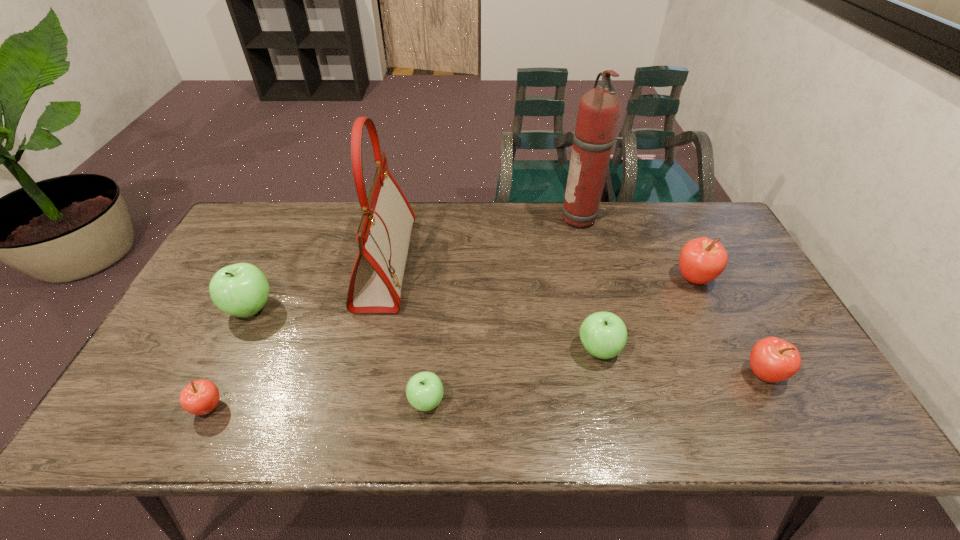
Where is `free space between the second farthest pink apple and the sixth object from right to left`? The height and width of the screenshot is (540, 960). free space between the second farthest pink apple and the sixth object from right to left is located at coordinates (575, 319).

At what (x,y) coordinates should I click in order to perform the action: click on free space between the fire extinguisher and the biggest pink apple. Please return your answer as a coordinate pair (x, y). Looking at the image, I should click on (638, 248).

This screenshot has height=540, width=960. Identify the location of vacant area that lies between the second green apple from left to right and the handbag. (406, 333).

Where is `unoccupied area between the handbag and the leftmost pink apple`? This screenshot has height=540, width=960. unoccupied area between the handbag and the leftmost pink apple is located at coordinates (298, 335).

Locate an element on the screen. This screenshot has height=540, width=960. free area in between the biggest green apple and the fire extinguisher is located at coordinates (417, 264).

At what (x,y) coordinates should I click in order to perform the action: click on vacant point located between the nearest pink apple and the farthest pink apple. Please return your answer as a coordinate pair (x, y). The image size is (960, 540). Looking at the image, I should click on (451, 343).

I want to click on empty space that is in between the smallest green apple and the biggest pink apple, so click(561, 340).

Find the location of a particular element. This screenshot has width=960, height=540. free space that is in between the second green apple from right to left and the nearest pink apple is located at coordinates (318, 404).

Find the location of a particular element. The width and height of the screenshot is (960, 540). free space that is in between the fire extinguisher and the farthest pink apple is located at coordinates (638, 248).

The image size is (960, 540). I want to click on blank region between the biggest green apple and the leftmost pink apple, so click(229, 357).